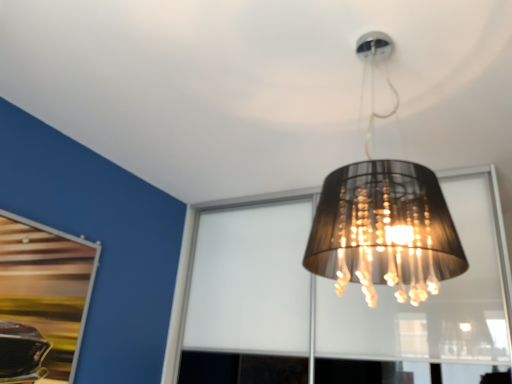
The width and height of the screenshot is (512, 384). What do you see at coordinates (384, 228) in the screenshot?
I see `matte black lampshade at center` at bounding box center [384, 228].

Find the location of a particular element. Image resolution: width=512 pixels, height=384 pixels. matte black lampshade at center is located at coordinates (384, 228).

Find the location of a particular element. This screenshot has width=512, height=384. matte black lampshade at center is located at coordinates click(x=384, y=228).